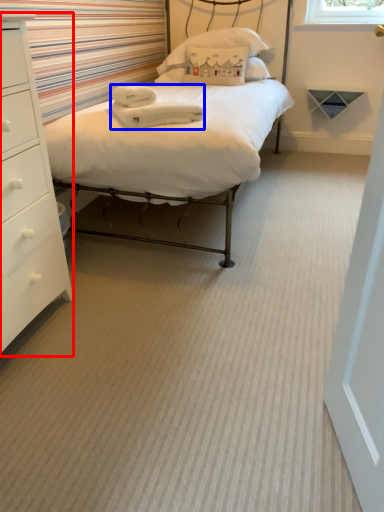
Question: Which of the following is the closest to the observer, chest of drawers (highlighted by a red box) or material (highlighted by a blue box)?

Choices:
 (A) chest of drawers
 (B) material

Answer: (A)